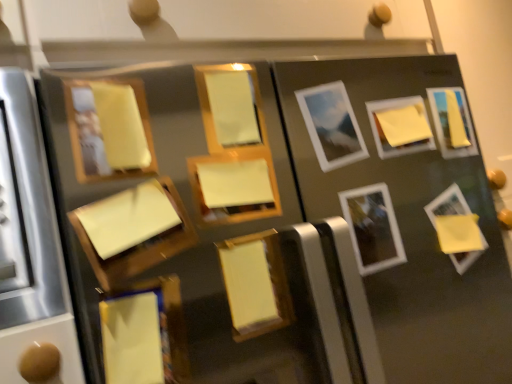
Question: From a real-world perspective, is matte yellow picture frame at center, which is the 8th picture frame in right-to-left order, positioned above or below yellow matte picture frame at lower left, which ranks as the third picture frame in left-to-right order?

Choices:
 (A) below
 (B) above

Answer: (B)

Question: In the image, is matte yellow picture frame at center, placed as the fourth picture frame when sorted from left to right, positioned in front of or behind yellow matte picture frame at lower left, the ninth picture frame in the right-to-left sequence?

Choices:
 (A) front
 (B) behind

Answer: (B)

Question: Considering the real-world distances, which object is closest to the yellow matte picture frame at center, acting as the sixth picture frame starting from the left?

Choices:
 (A) yellow matte picture frame at lower right, which is counted as the 10th picture frame, starting from the left
 (B) yellow matte picture frame at upper right, which ranks as the third picture frame in right-to-left order
 (C) matte wood picture frame at upper left, which ranks as the first picture frame in left-to-right order
 (D) white glossy picture frame at center-right, the eighth picture frame from the left
 (E) yellow matte picture frame at upper right, which is counted as the eleventh picture frame, starting from the left

Answer: (D)

Question: Considering the real-world distances, which object is closest to the matte wood picture frame at upper left, which is counted as the eleventh picture frame, starting from the right?

Choices:
 (A) yellow matte picture frame at center, the sixth picture frame from the right
 (B) yellow matte picture frame at upper right, which ranks as the third picture frame in right-to-left order
 (C) yellow matte picture frame at upper right, the 1th picture frame viewed from the right
 (D) matte wood picture frame at center, the 5th picture frame in the left-to-right sequence
 (E) matte white picture frame at center, which appears as the 7th picture frame when viewed from the left

Answer: (D)